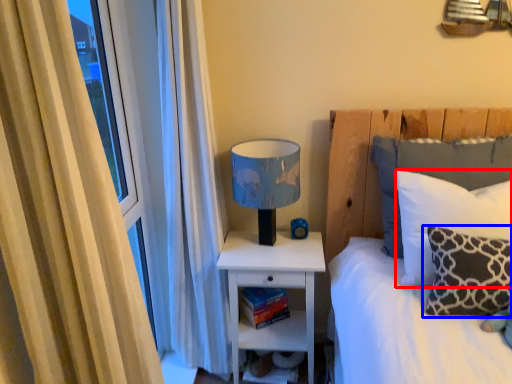
Question: Which of the following is the closest to the observer, pillow (highlighted by a red box) or pillow (highlighted by a blue box)?

Choices:
 (A) pillow
 (B) pillow

Answer: (B)